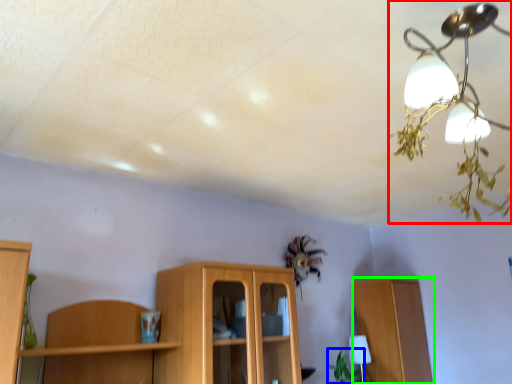
Question: Considering the real-world distances, which object is farthest from lamp (highlighted by a red box)? plant (highlighted by a blue box) or cabinetry (highlighted by a green box)?

Choices:
 (A) plant
 (B) cabinetry

Answer: (A)